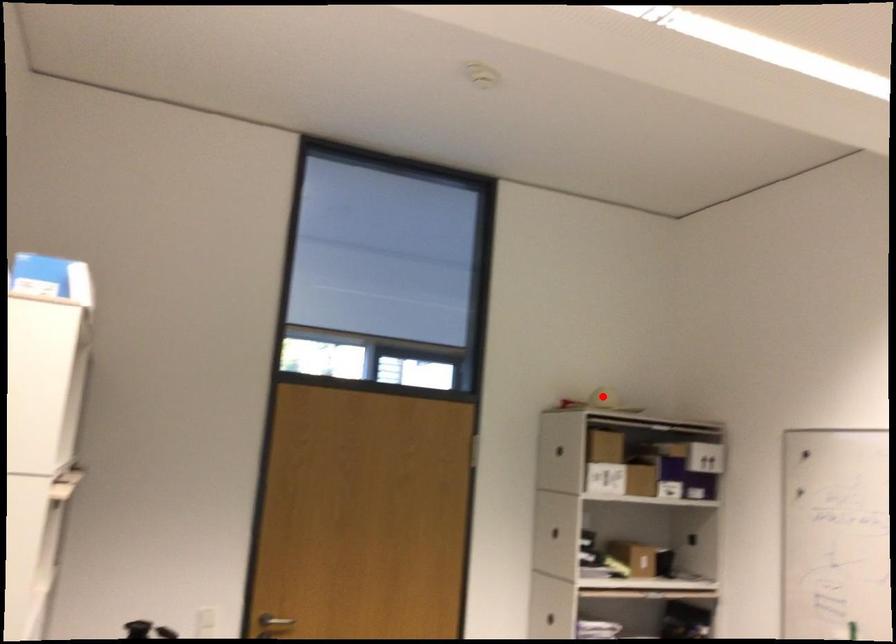
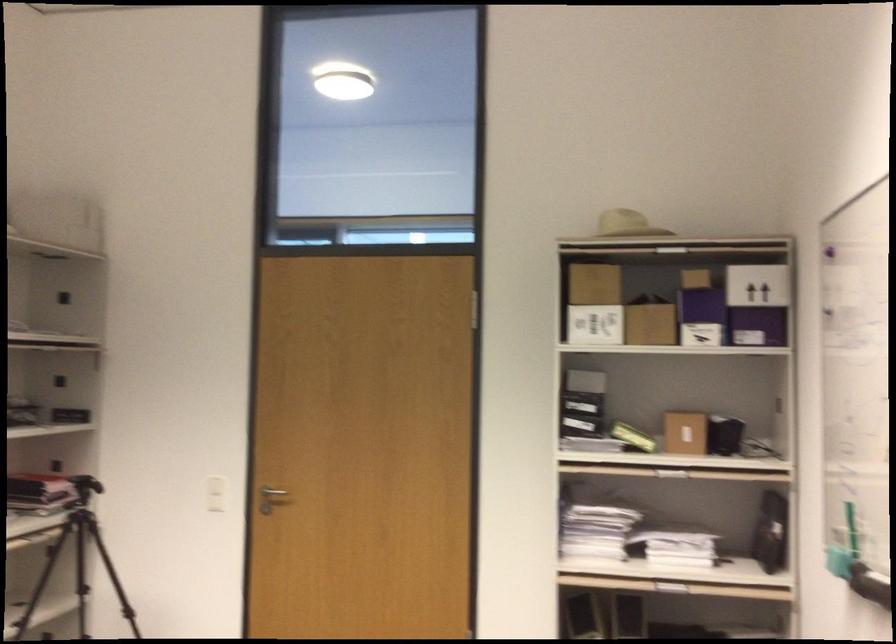
In the second image, find the point that corresponds to the highlighted location in the first image.

(626, 223)